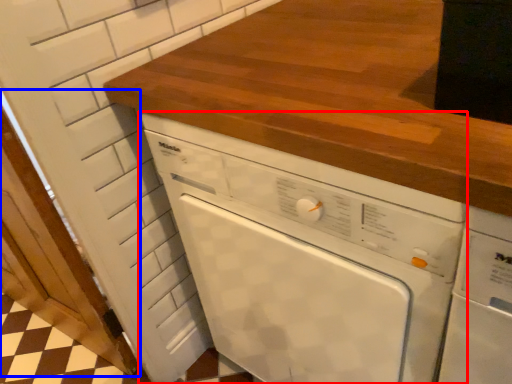
Question: Which point is closer to the camera, home appliance (highlighted by a red box) or door (highlighted by a blue box)?

Choices:
 (A) home appliance
 (B) door

Answer: (A)